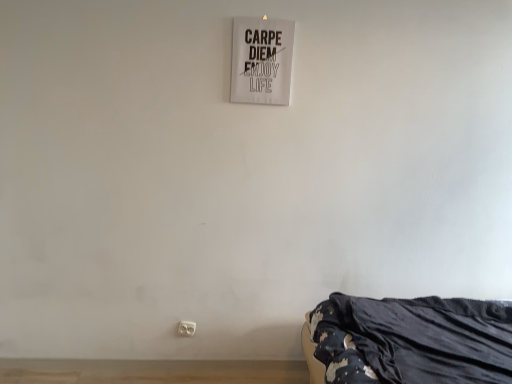
Question: Can you confirm if black fabric bed at lower right is smaller than white plastic electric outlet at lower center?

Choices:
 (A) no
 (B) yes

Answer: (A)

Question: Is black fabric bed at lower right aimed at white plastic electric outlet at lower center?

Choices:
 (A) no
 (B) yes

Answer: (A)

Question: Is black fabric bed at lower right directly adjacent to white plastic electric outlet at lower center?

Choices:
 (A) yes
 (B) no

Answer: (B)

Question: Is black fabric bed at lower right wider than white plastic electric outlet at lower center?

Choices:
 (A) yes
 (B) no

Answer: (A)

Question: From a real-world perspective, is black fabric bed at lower right located higher than white plastic electric outlet at lower center?

Choices:
 (A) yes
 (B) no

Answer: (A)

Question: Is the depth of black fabric bed at lower right greater than that of white plastic electric outlet at lower center?

Choices:
 (A) yes
 (B) no

Answer: (B)

Question: Is white plastic electric outlet at lower center oriented towards black fabric bed at lower right?

Choices:
 (A) yes
 (B) no

Answer: (B)

Question: Can we say white plastic electric outlet at lower center lies outside black fabric bed at lower right?

Choices:
 (A) no
 (B) yes

Answer: (B)

Question: Is white plastic electric outlet at lower center further to camera compared to black fabric bed at lower right?

Choices:
 (A) no
 (B) yes

Answer: (B)

Question: From a real-world perspective, is white plastic electric outlet at lower center located beneath black fabric bed at lower right?

Choices:
 (A) no
 (B) yes

Answer: (B)

Question: Is white plastic electric outlet at lower center thinner than black fabric bed at lower right?

Choices:
 (A) yes
 (B) no

Answer: (A)

Question: Is white plastic electric outlet at lower center oriented away from black fabric bed at lower right?

Choices:
 (A) yes
 (B) no

Answer: (B)

Question: Is white plastic electric outlet at lower center to the left of white paper sign at upper center from the viewer's perspective?

Choices:
 (A) yes
 (B) no

Answer: (A)